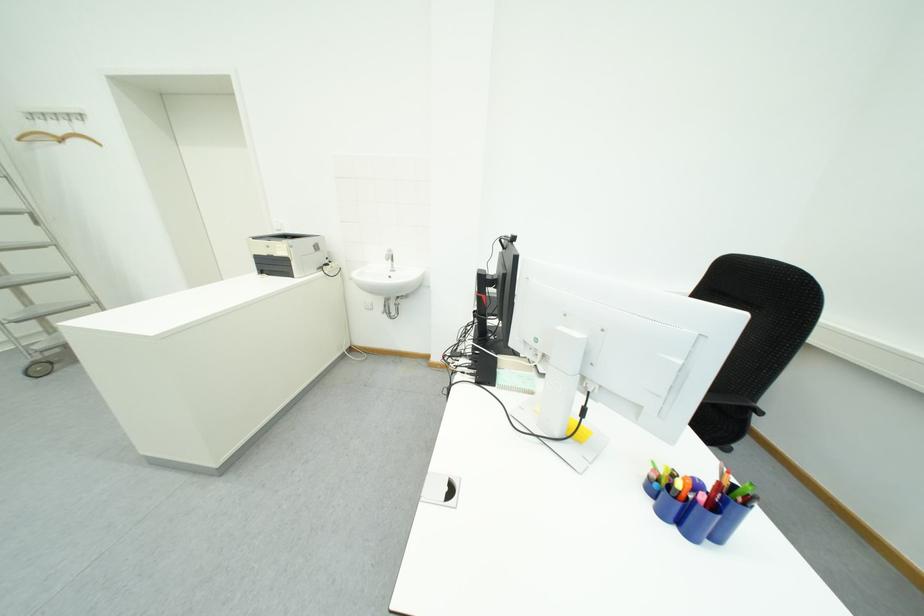
Where would you sit the black chair sitting surface? Please return your answer as a coordinate pair (x, y).

(720, 424)